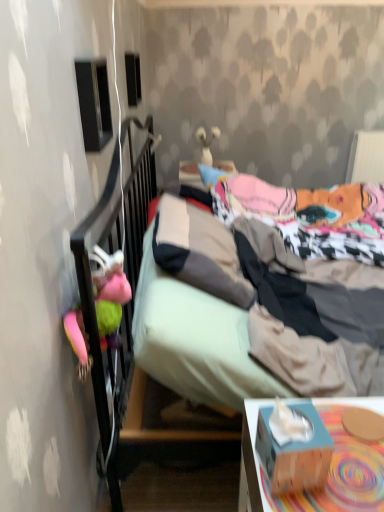
Question: From the image's perspective, is black matte speaker at upper left, which is counted as the first loudspeaker, starting from the bottom, located above blue cardboard tissue box at lower right?

Choices:
 (A) no
 (B) yes

Answer: (B)

Question: From the image's perspective, is black matte speaker at upper left, arranged as the 2th loudspeaker when viewed from the top, located beneath blue cardboard tissue box at lower right?

Choices:
 (A) yes
 (B) no

Answer: (B)

Question: Is black matte speaker at upper left, arranged as the 2th loudspeaker when viewed from the top, beside blue cardboard tissue box at lower right?

Choices:
 (A) no
 (B) yes

Answer: (A)

Question: Is black matte speaker at upper left, positioned as the 2th loudspeaker in back-to-front order, turned away from blue cardboard tissue box at lower right?

Choices:
 (A) no
 (B) yes

Answer: (A)

Question: Does black matte speaker at upper left, which is counted as the first loudspeaker, starting from the bottom, have a greater height compared to blue cardboard tissue box at lower right?

Choices:
 (A) no
 (B) yes

Answer: (B)

Question: Looking at the image, does blue cardboard tissue box at lower right seem bigger or smaller compared to black plastic speaker at upper center, which is the second loudspeaker in bottom-to-top order?

Choices:
 (A) big
 (B) small

Answer: (B)

Question: Is blue cardboard tissue box at lower right in front of or behind black plastic speaker at upper center, which is the 2th loudspeaker from front to back, in the image?

Choices:
 (A) behind
 (B) front

Answer: (B)

Question: Does point (307, 458) appear closer or farther from the camera than point (129, 67)?

Choices:
 (A) closer
 (B) farther

Answer: (A)

Question: Is blue cardboard tissue box at lower right to the left or to the right of black plastic speaker at upper center, which is the second loudspeaker in bottom-to-top order, in the image?

Choices:
 (A) right
 (B) left

Answer: (A)

Question: From their relative heights in the image, would you say multicolored plush toy at left, the 1th toy positioned from the front, is taller or shorter than black matte speaker at upper left, which is counted as the first loudspeaker, starting from the bottom?

Choices:
 (A) tall
 (B) short

Answer: (B)

Question: Is multicolored plush toy at left, the 2th toy when ordered from back to front, wider or thinner than black matte speaker at upper left, marked as the first loudspeaker in a front-to-back arrangement?

Choices:
 (A) thin
 (B) wide

Answer: (B)

Question: From the image's perspective, is multicolored plush toy at left, the 1th toy from the left, positioned above or below black matte speaker at upper left, arranged as the 2th loudspeaker when viewed from the top?

Choices:
 (A) above
 (B) below

Answer: (B)

Question: Is multicolored plush toy at left, the 1th toy from the left, in front of or behind black matte speaker at upper left, marked as the first loudspeaker in a front-to-back arrangement, in the image?

Choices:
 (A) front
 (B) behind

Answer: (A)

Question: Choose the correct answer: Is blue cardboard tissue box at lower right inside textured fabric bed at center or outside it?

Choices:
 (A) inside
 (B) outside

Answer: (B)

Question: Looking at the image, does blue cardboard tissue box at lower right seem bigger or smaller compared to textured fabric bed at center?

Choices:
 (A) small
 (B) big

Answer: (A)